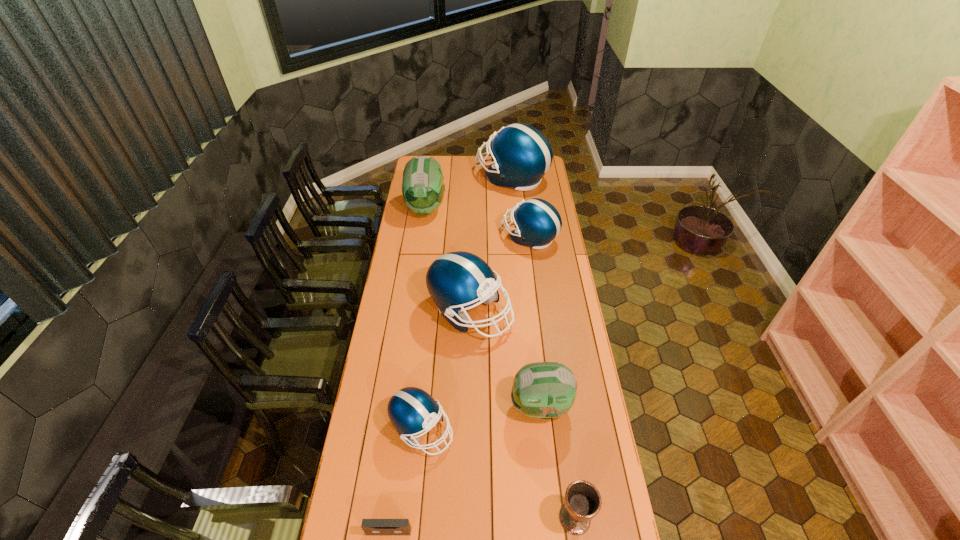
Where is `the shortest football helmet`? the shortest football helmet is located at coordinates (411, 410).

At what (x,y) coordinates should I click in order to perform the action: click on chalice. Please return your answer as a coordinate pair (x, y). The image size is (960, 540). Looking at the image, I should click on (583, 501).

Find the location of a particular element. This screenshot has width=960, height=540. videotape is located at coordinates (370, 526).

Find the location of a particular element. The width and height of the screenshot is (960, 540). free space located 0.210m at the front of the tallest object with the faceguard is located at coordinates (441, 177).

Where is `vacant point located at the front of the tallest object with the faceguard`? This screenshot has height=540, width=960. vacant point located at the front of the tallest object with the faceguard is located at coordinates (427, 177).

Find the location of a particular element. This screenshot has height=540, width=960. free location located 0.270m at the front of the tallest object with the faceguard is located at coordinates click(x=431, y=177).

This screenshot has width=960, height=540. In order to click on free space located on the visor of the bigger green football helmet in this screenshot , I will do click(418, 264).

The height and width of the screenshot is (540, 960). Identify the location of vacant point located at the front of the third smallest blue football helmet with the faceguard. (526, 312).

The image size is (960, 540). What are the coordinates of `vacant space located at the front of the third biggest blue football helmet with the faceguard` in the screenshot? It's located at (423, 237).

Locate an element on the screen. Image resolution: width=960 pixels, height=540 pixels. vacant region located 0.080m at the front of the third biggest blue football helmet with the faceguard is located at coordinates (485, 237).